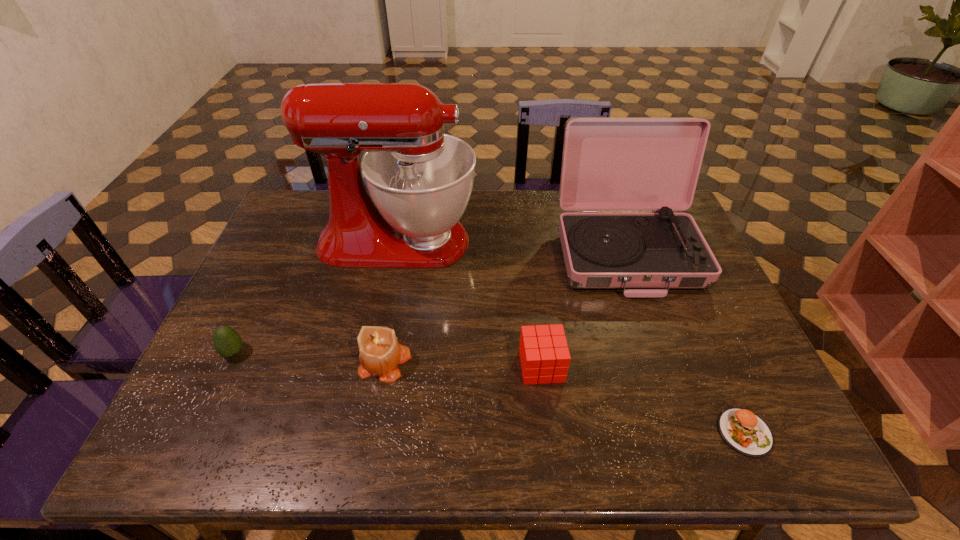
Locate an element on the screen. The width and height of the screenshot is (960, 540). vacant space located 0.130m on the back of the fourth object from left to right is located at coordinates (535, 309).

Identify the location of vacant space located 0.140m on the back of the leftmost object. Image resolution: width=960 pixels, height=540 pixels. (258, 301).

I want to click on vacant space located on the left of the nearest object, so click(555, 433).

The height and width of the screenshot is (540, 960). In order to click on mixer located at the far edge in this screenshot , I will do `click(419, 180)`.

This screenshot has width=960, height=540. Find the location of `record player that is at the far edge`. record player that is at the far edge is located at coordinates (609, 164).

Image resolution: width=960 pixels, height=540 pixels. Identify the location of object present at the near edge. (745, 432).

Find the location of a particular element. The image size is (960, 540). mixer positioned at the left edge is located at coordinates (419, 180).

The width and height of the screenshot is (960, 540). Identify the location of avocado that is positioned at the left edge. 227,342.

This screenshot has width=960, height=540. What are the coordinates of `record player that is at the right edge` in the screenshot? It's located at (609, 164).

Find the location of a particular element. patty that is at the right edge is located at coordinates (745, 432).